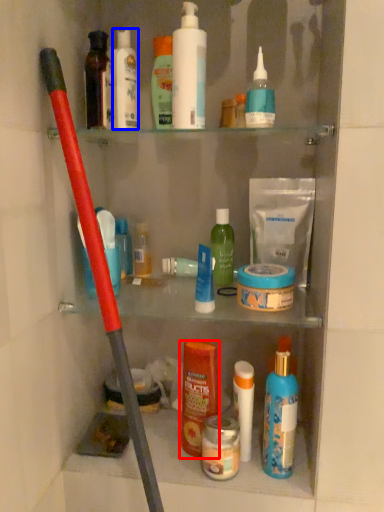
Question: Which point is closer to the camera, toiletry (highlighted by a red box) or toiletry (highlighted by a blue box)?

Choices:
 (A) toiletry
 (B) toiletry

Answer: (A)